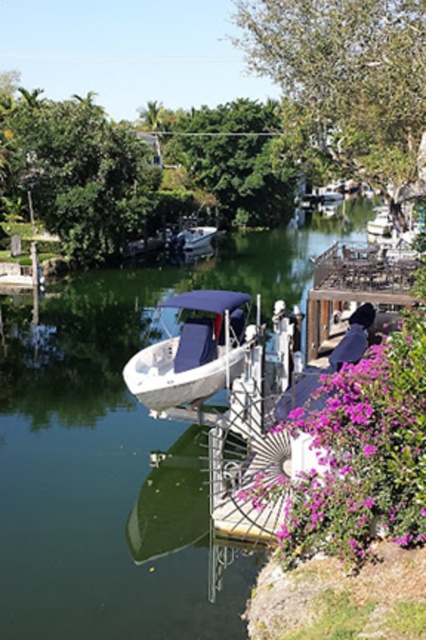
Question: Does purple matte flower at lower right appear over white matte boat at center?

Choices:
 (A) no
 (B) yes

Answer: (A)

Question: Which object appears farthest from the camera in this image?

Choices:
 (A) white matte boat at center
 (B) green smooth water at center

Answer: (A)

Question: Which object is farther from the camera taking this photo?

Choices:
 (A) white matte boat at center
 (B) purple matte flower at lower right

Answer: (A)

Question: Can you confirm if green smooth water at center is bigger than purple matte flower at lower right?

Choices:
 (A) no
 (B) yes

Answer: (B)

Question: Is green smooth water at center above white matte boat at center?

Choices:
 (A) no
 (B) yes

Answer: (B)

Question: Which point appears closest to the camera in this image?

Choices:
 (A) (325, 381)
 (B) (192, 308)

Answer: (A)